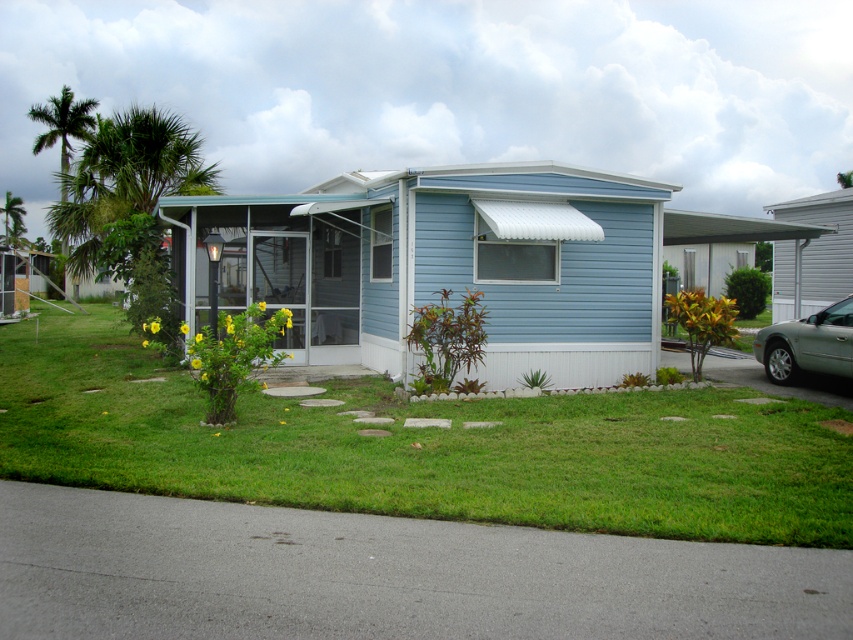
You are a delivery person trying to park your 2.5 meters wide truck next to the satin silver car at right and the green leafy palm tree at upper left. Can you safely park your truck between them without hitting either object?

The satin silver car at right has a lesser width compared to green leafy palm tree at upper left. However, the question is about the distance between the car and the tree, not their widths. Since the description only mentions the car is narrower than the tree, but doesn not provide information about the distance between them, it is impossible to determine if the truck can safely park between them.

Looking at this image, you are planning to install a new sprinkler system in the front yard. The sprinkler can cover an area up to the width of the green leafy palm tree at upper left. Will the sprinkler be able to sufficiently water the green grass lawn at center?

The green grass lawn at center has a lesser width compared to the green leafy palm tree at upper left. Since the sprinkler can cover up to the width of the palm tree, it should be sufficient to water the entire green grass lawn at center.

You are a gardener who needs to mow the lawn. The lawn mower you have can only cut grass that is shorter than the height of the satin silver car at right. Based on the scene, will the green grass lawn at center be suitable for mowing with your current mower?

The green grass lawn at center is not as tall as the satin silver car at right, so it is shorter than the required height. Therefore, the lawn mower can safely mow the green grass lawn at center.